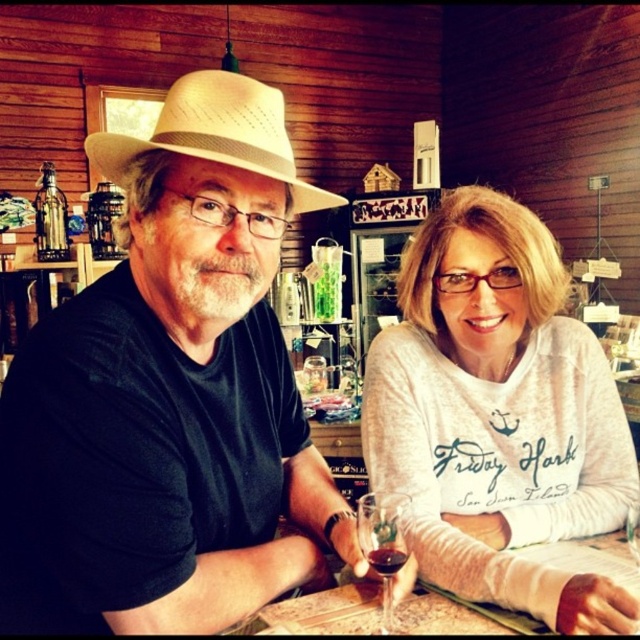
Question: Which object is the farthest from the transparent glass at lower center?

Choices:
 (A) matte straw hat at center
 (B) beige straw cowboy hat at upper center
 (C) white soft sweater at center
 (D) translucent glass table at center

Answer: (B)

Question: Is white soft sweater at center positioned before transparent glass at lower center?

Choices:
 (A) yes
 (B) no

Answer: (A)

Question: In this image, where is beige straw cowboy hat at upper center located relative to translucent glass at lower center?

Choices:
 (A) right
 (B) left

Answer: (B)

Question: Which of these objects is positioned farthest from the white soft sweater at center?

Choices:
 (A) matte straw hat at center
 (B) beige straw cowboy hat at upper center
 (C) translucent glass table at center
 (D) translucent glass at lower center

Answer: (B)

Question: Which object is closer to the camera taking this photo?

Choices:
 (A) transparent glass at lower center
 (B) translucent glass table at center

Answer: (A)

Question: Does beige straw cowboy hat at upper center have a smaller size compared to transparent glass at lower center?

Choices:
 (A) yes
 (B) no

Answer: (B)